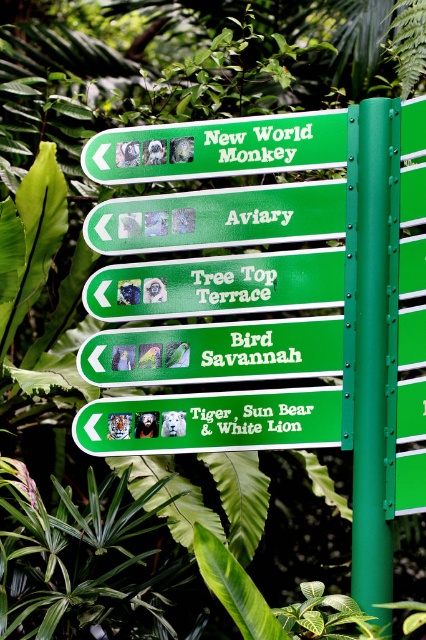
Which is above, green painted metal pole at center right or green plastic sign at center?

green plastic sign at center is above.

Does green painted metal pole at center right have a greater height compared to green plastic sign at center?

Yes, green painted metal pole at center right is taller than green plastic sign at center.

Describe the element at coordinates (371, 342) in the screenshot. I see `green painted metal pole at center right` at that location.

The image size is (426, 640). Identify the location of green painted metal pole at center right. (371, 342).

Who is more distant from viewer, (x=235, y=262) or (x=255, y=128)?

The point (x=255, y=128) is more distant.

Is point (325, 300) behind point (317, 140)?

No.

Describe the element at coordinates (216, 285) in the screenshot. I see `green matte sign at center` at that location.

Where is `green matte sign at center`? green matte sign at center is located at coordinates (216, 285).

Who is positioned more to the right, green painted metal pole at center right or green matte sign at center?

Positioned to the right is green painted metal pole at center right.

Is point (391, 509) positioned after point (270, 289)?

No.

The image size is (426, 640). In order to click on green painted metal pole at center right in this screenshot , I will do `click(371, 342)`.

Locate an element on the screen. green painted metal pole at center right is located at coordinates (371, 342).